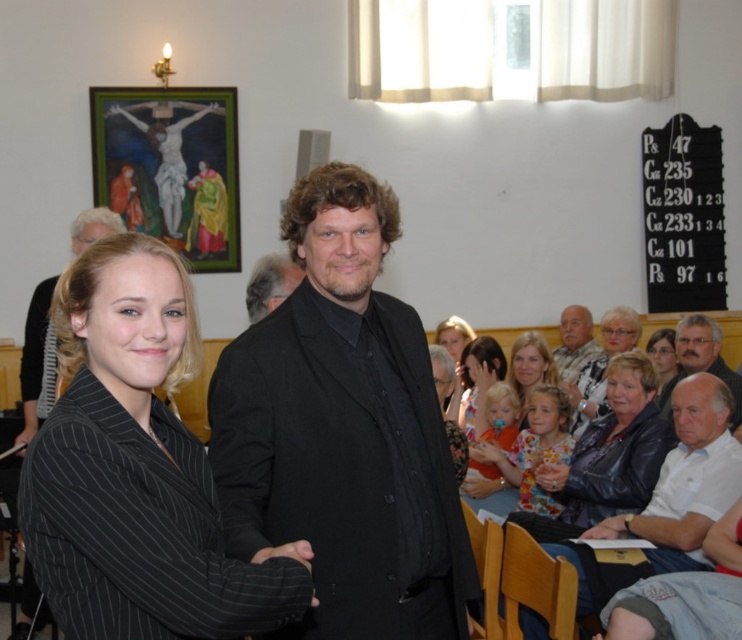
Question: Does black pinstripe blazer at center have a larger size compared to dark brown hair at center?

Choices:
 (A) no
 (B) yes

Answer: (B)

Question: Where is dark brown hair at center located in relation to gray fabric at right in the image?

Choices:
 (A) left
 (B) right

Answer: (A)

Question: Based on their relative distances, which object is farther from the smooth blonde hair at center?

Choices:
 (A) black matte suit at center
 (B) black pinstripe blazer at center
 (C) dark brown hair at center
 (D) white textured shirt at lower right

Answer: (B)

Question: Among these points, which one is nearest to the camera?

Choices:
 (A) (295, 284)
 (B) (654, 364)
 (C) (706, 348)
 (D) (525, 368)

Answer: (A)

Question: Which object appears closest to the camera in this image?

Choices:
 (A) gray hair man at lower right
 (B) black pinstripe blazer at center
 (C) white textured shirt at lower right

Answer: (B)

Question: Is dark brown hair at center to the left of matte black hair at center from the viewer's perspective?

Choices:
 (A) no
 (B) yes

Answer: (B)